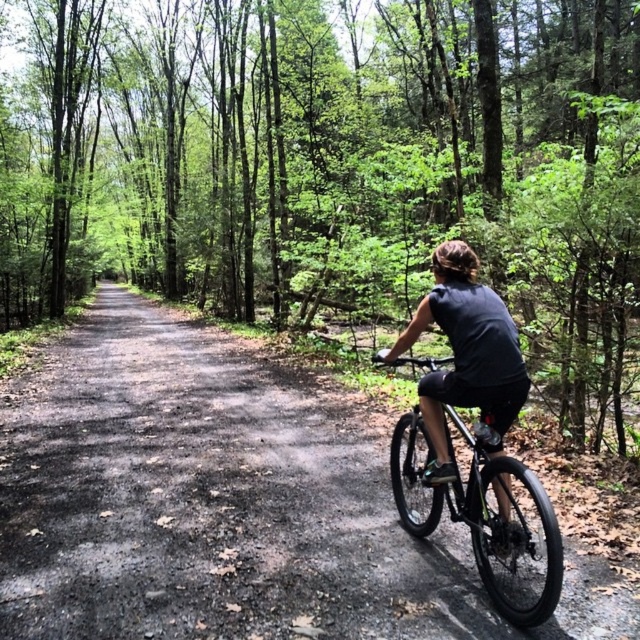
Question: Estimate the real-world distances between objects in this image. Which object is closer to the green leafy forest at center?

Choices:
 (A) black matte bicycle at center
 (B) dirt road at center
 (C) shiny black bike at right

Answer: (C)

Question: Which object is closer to the camera taking this photo?

Choices:
 (A) dirt road at center
 (B) brown matte helmet at upper center

Answer: (B)

Question: Which of the following is the closest to the observer?

Choices:
 (A) black matte bicycle at center
 (B) shiny black bike at right
 (C) dirt road at center

Answer: (B)

Question: From the image, what is the correct spatial relationship of dirt road at center in relation to shiny black bike at right?

Choices:
 (A) left
 (B) right

Answer: (A)

Question: Where is green leafy forest at center located in relation to shiny black bike at right in the image?

Choices:
 (A) right
 (B) left

Answer: (B)

Question: Does green leafy forest at center appear on the left side of black matte bicycle at center?

Choices:
 (A) yes
 (B) no

Answer: (A)